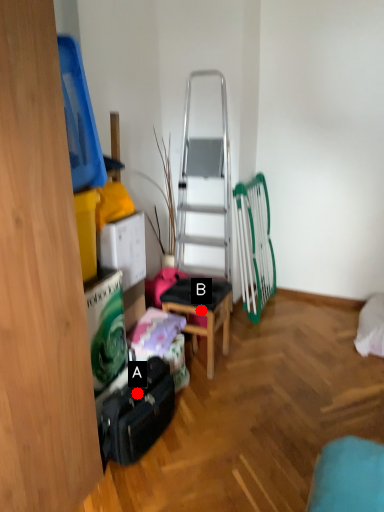
Question: Two points are circled on the image, labeled by A and B beside each circle. Which point is further to the camera?

Choices:
 (A) A is further
 (B) B is further

Answer: (B)